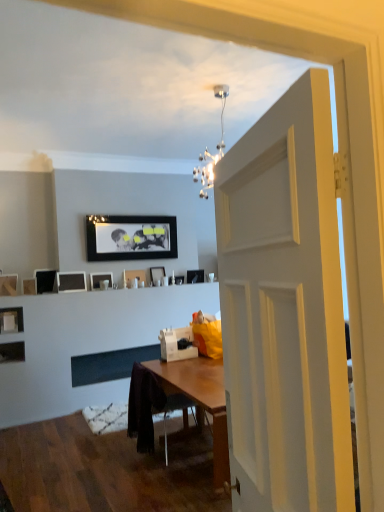
Identify the location of vacant space underneath black glossy picture frame at upper center, arranged as the fifth picture frame when viewed from the right (from a real-world perspective). (130, 344).